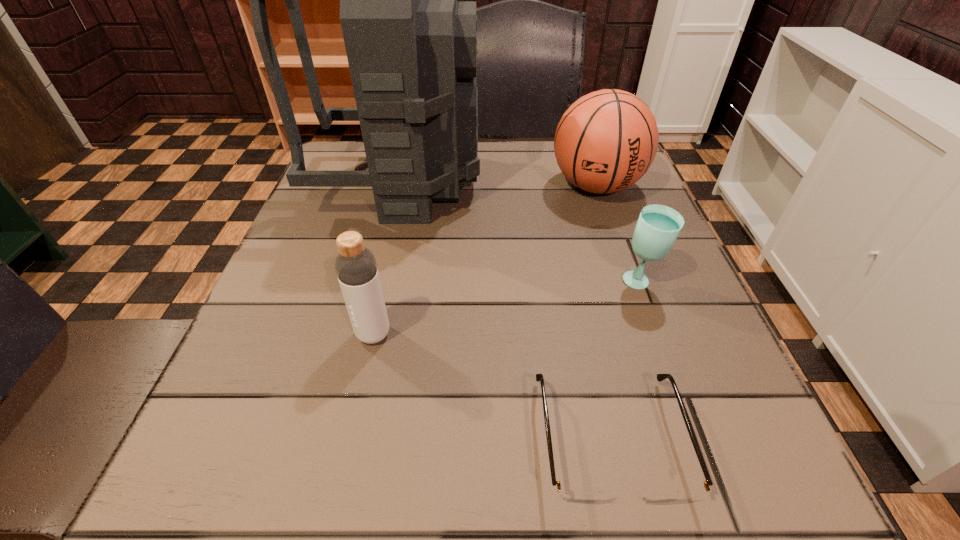
You are a GUI agent. You are given a task and a screenshot of the screen. Output one action in this format:
    pyautogui.click(x=<x>, y=<y>)
    Task: Click on the free point that satisfies the following two spatial constraints: 1. on the surface of the basketball near the brand logo; 2. on the right side of the glass
    Image resolution: width=960 pixels, height=540 pixels.
    Given the screenshot: What is the action you would take?
    pyautogui.click(x=630, y=282)

The image size is (960, 540). In order to click on vacant region that satisfies the following two spatial constraints: 1. on the back side of the third nearest object; 2. on the front compartment of the tallest object in this screenshot , I will do `click(604, 183)`.

Locate an element on the screen. The width and height of the screenshot is (960, 540). vacant space that satisfies the following two spatial constraints: 1. on the surface of the basketball near the brand logo; 2. on the left side of the third farthest object is located at coordinates (630, 282).